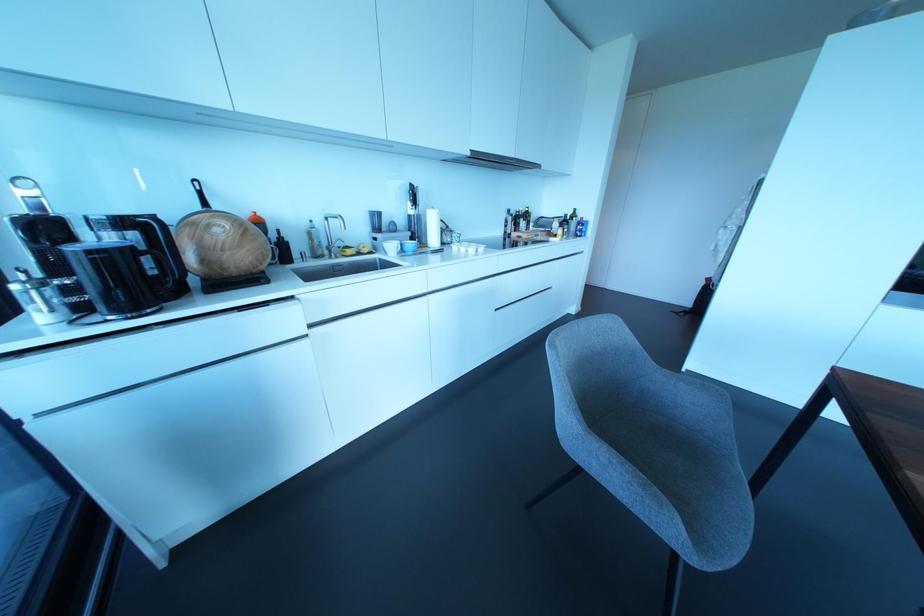
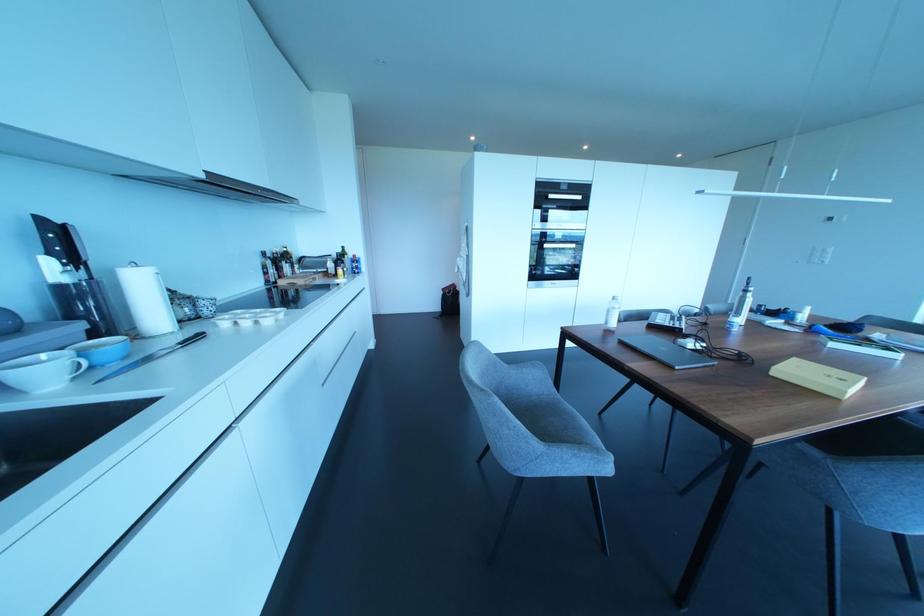
Question: The images are taken continuously from a first-person perspective. In which direction is your viewpoint rotating?

Choices:
 (A) Left
 (B) Right
 (C) Up
 (D) Down

Answer: (B)